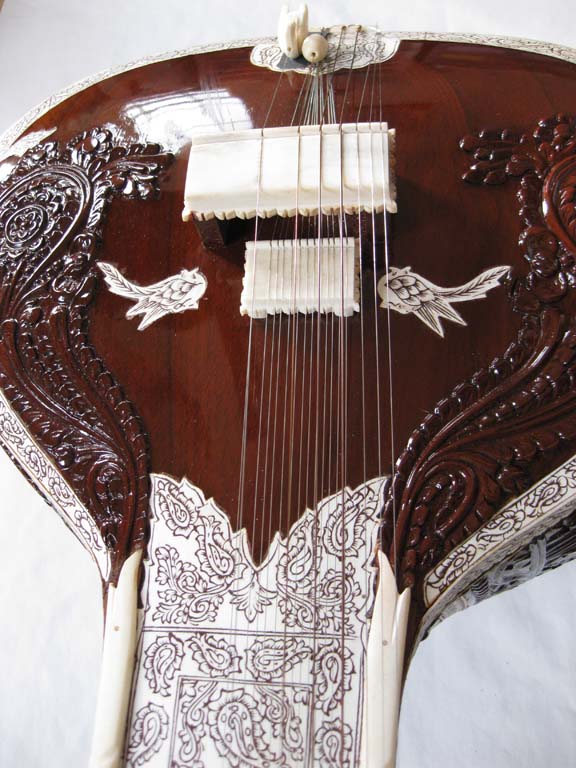
Locate an element on the screen. polished wood is located at coordinates click(447, 113).